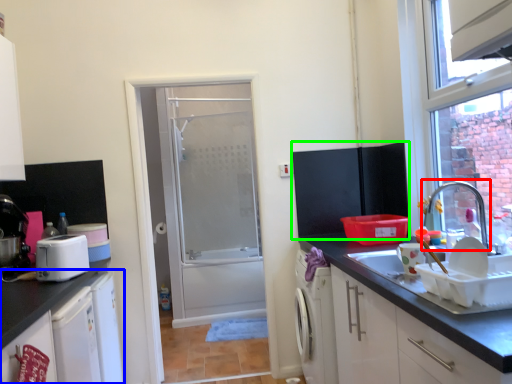
Question: Considering the real-world distances, which object is closest to tap (highlighted by a red box)? cabinetry (highlighted by a blue box) or wide (highlighted by a green box).

Choices:
 (A) cabinetry
 (B) wide

Answer: (B)